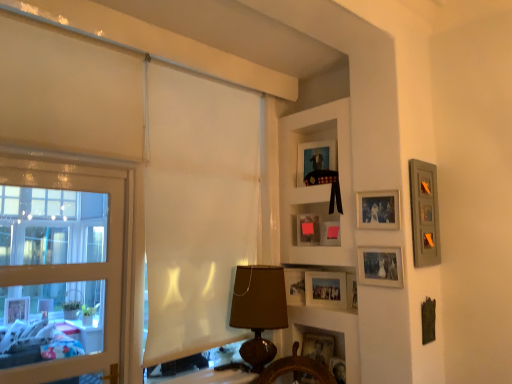
Question: Relative to wooden frame window at left, is wooden ship's wheel at lower center, acting as the first shelf starting from the bottom, in front or behind?

Choices:
 (A) behind
 (B) front

Answer: (A)

Question: Is wooden ship's wheel at lower center, acting as the first shelf starting from the bottom, situated inside wooden frame window at left or outside?

Choices:
 (A) inside
 (B) outside

Answer: (B)

Question: Estimate the real-world distances between objects in this image. Which object is farther from the wooden picture frame at lower center, the first picture frame when ordered from bottom to top?

Choices:
 (A) matte pink picture frame at center, placed as the sixth picture frame when sorted from bottom to top
 (B) wooden shelf at upper center, positioned as the first shelf in top-to-bottom order
 (C) matte black picture frame at upper center, the ninth picture frame ordered from the bottom
 (D) wooden picture frame at lower center, the eighth picture frame positioned from the top
 (E) matte pink picture frame at center, the 5th picture frame from the top

Answer: (C)

Question: Which object is positioned farthest from the matte pink picture frame at center, acting as the fifth picture frame starting from the bottom?

Choices:
 (A) matte silver picture frame at center-right, which appears as the 6th picture frame when viewed from the top
 (B) matte silver photo frame at upper right, acting as the 8th picture frame starting from the bottom
 (C) wooden ship's wheel at lower center, acting as the first shelf starting from the bottom
 (D) matte pink picture frame at center, the fourth picture frame viewed from the top
 (E) brown fabric lampshade at center

Answer: (E)